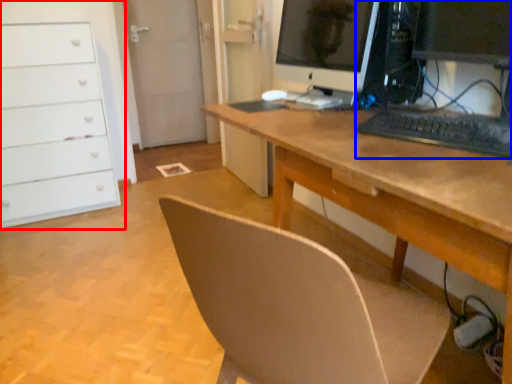
Question: Which point is further to the camera, chest of drawers (highlighted by a red box) or computer (highlighted by a blue box)?

Choices:
 (A) chest of drawers
 (B) computer

Answer: (A)